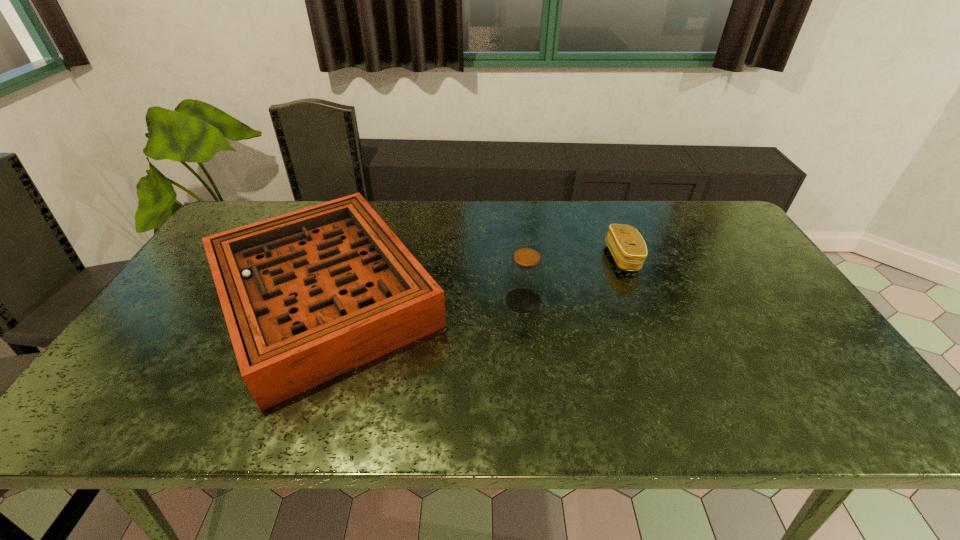
Identify which object is the nearest to the gameboard. Please provide its 2D coordinates. Your answer should be formatted as a tuple, i.e. [(x, y)], where the tuple contains the x and y coordinates of a point satisfying the conditions above.

[(525, 275)]

Locate an element on the screen. The width and height of the screenshot is (960, 540). free spot that satisfies the following two spatial constraints: 1. on the front side of the tallest object; 2. on the left side of the gameboard is located at coordinates (324, 300).

Identify the location of free space that satisfies the following two spatial constraints: 1. on the zipper side of the clutch bag; 2. on the front side of the gameboard. The image size is (960, 540). click(638, 297).